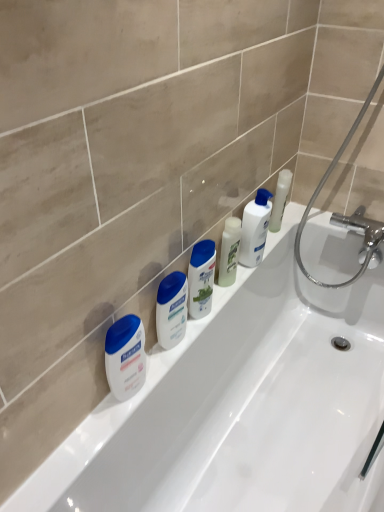
Question: Does white glossy bathtub at center lie behind white glossy lotion at upper center, which appears as the 3th toiletry when viewed from the left?

Choices:
 (A) yes
 (B) no

Answer: (B)

Question: Is white glossy bathtub at center outside of white glossy lotion at upper center, acting as the first toiletry starting from the right?

Choices:
 (A) yes
 (B) no

Answer: (A)

Question: Considering the relative positions of white glossy bathtub at center and white glossy lotion at upper center, acting as the first toiletry starting from the right, in the image provided, is white glossy bathtub at center to the left of white glossy lotion at upper center, acting as the first toiletry starting from the right, from the viewer's perspective?

Choices:
 (A) no
 (B) yes

Answer: (A)

Question: Can you confirm if white glossy bathtub at center is thinner than white glossy lotion at upper center, acting as the first toiletry starting from the right?

Choices:
 (A) no
 (B) yes

Answer: (A)

Question: Would you say white glossy bathtub at center is a long distance from white glossy lotion at upper center, which appears as the 3th toiletry when viewed from the left?

Choices:
 (A) yes
 (B) no

Answer: (B)

Question: From a real-world perspective, is white glossy bathtub at center beneath white glossy lotion at upper center, acting as the first toiletry starting from the right?

Choices:
 (A) yes
 (B) no

Answer: (A)

Question: Can you confirm if chrome metallic shower at upper right is wider than white glossy bathtub at center?

Choices:
 (A) yes
 (B) no

Answer: (B)

Question: Is the surface of chrome metallic shower at upper right in direct contact with white glossy bathtub at center?

Choices:
 (A) no
 (B) yes

Answer: (A)

Question: Is chrome metallic shower at upper right facing towards white glossy bathtub at center?

Choices:
 (A) no
 (B) yes

Answer: (B)

Question: Is white glossy bathtub at center surrounded by chrome metallic shower at upper right?

Choices:
 (A) yes
 (B) no

Answer: (B)

Question: Can you confirm if chrome metallic shower at upper right is positioned to the right of white glossy bathtub at center?

Choices:
 (A) no
 (B) yes

Answer: (B)

Question: From a real-world perspective, is chrome metallic shower at upper right below white glossy bathtub at center?

Choices:
 (A) yes
 (B) no

Answer: (B)

Question: Considering the relative sizes of white glossy lotion at upper center, which appears as the 3th toiletry when viewed from the left, and white plastic shampoo bottle at center, the 2th toiletry in the right-to-left sequence, in the image provided, is white glossy lotion at upper center, which appears as the 3th toiletry when viewed from the left, smaller than white plastic shampoo bottle at center, the 2th toiletry in the right-to-left sequence,?

Choices:
 (A) yes
 (B) no

Answer: (B)